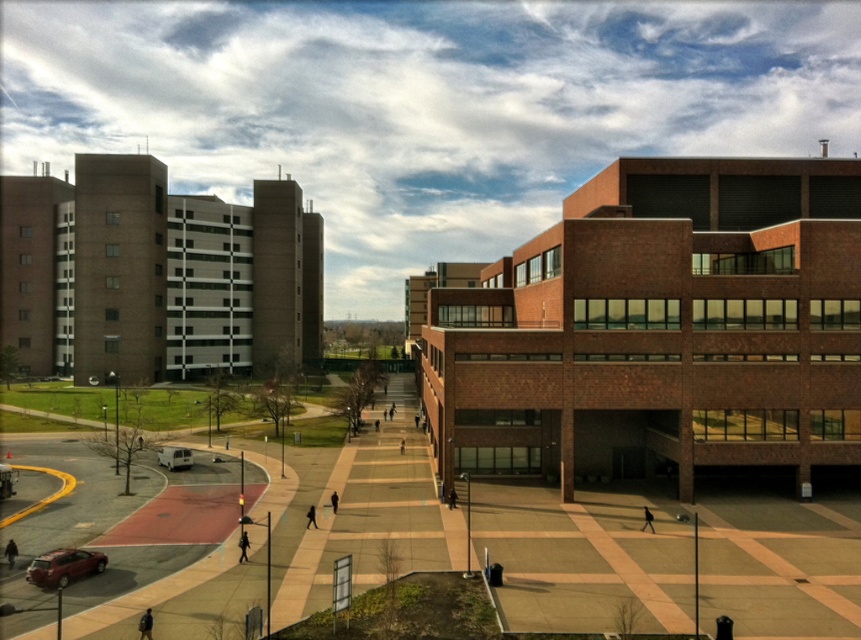
Who is more distant from viewer, (x=59, y=564) or (x=189, y=458)?

The point (x=189, y=458) is more distant.

Can you confirm if metallic red car at bottom left is wider than white matte van at lower left?

Incorrect, metallic red car at bottom left's width does not surpass white matte van at lower left's.

Measure the distance between metallic red car at bottom left and camera.

metallic red car at bottom left and camera are 115.44 feet apart from each other.

At what (x,y) coordinates should I click in order to perform the action: click on metallic red car at bottom left. Please return your answer as a coordinate pair (x, y). The image size is (861, 640). Looking at the image, I should click on (63, 566).

Is point (797, 273) positioned after point (177, 451)?

No, it is not.

Is brick building at center bigger than white matte van at lower left?

Indeed, brick building at center has a larger size compared to white matte van at lower left.

Between point (778, 360) and point (174, 456), which one is positioned behind?

Positioned behind is point (174, 456).

At what (x,y) coordinates should I click in order to perform the action: click on brick building at center. Please return your answer as a coordinate pair (x, y). This screenshot has height=640, width=861. Looking at the image, I should click on (660, 330).

Does brick building at center have a larger size compared to metallic red car at bottom left?

Indeed, brick building at center has a larger size compared to metallic red car at bottom left.

Is brick building at center to the left of metallic red car at bottom left from the viewer's perspective?

In fact, brick building at center is to the right of metallic red car at bottom left.

Where is `brick building at center`? The height and width of the screenshot is (640, 861). brick building at center is located at coordinates (660, 330).